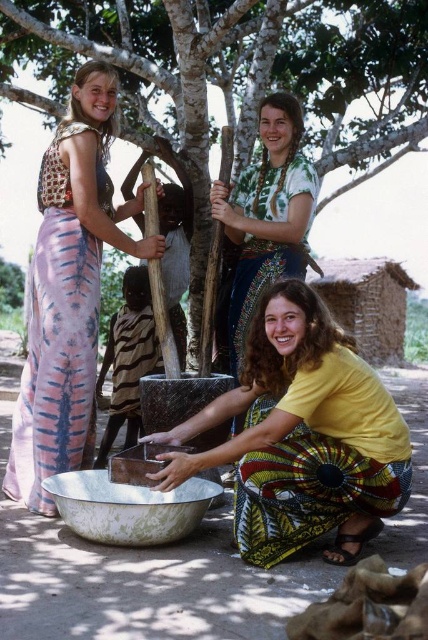
Looking at this image, which is below, pink tie-dye dress at left or striped fabric cloth at center?

striped fabric cloth at center

Can you confirm if pink tie-dye dress at left is taller than striped fabric cloth at center?

Correct, pink tie-dye dress at left is much taller as striped fabric cloth at center.

Locate an element on the screen. Image resolution: width=428 pixels, height=640 pixels. pink tie-dye dress at left is located at coordinates (68, 291).

Identify the location of pink tie-dye dress at left. Image resolution: width=428 pixels, height=640 pixels. (68, 291).

Is pink tie-dye dress at left below greenish metallic bowl at lower center?

No.

Does pink tie-dye dress at left have a larger size compared to greenish metallic bowl at lower center?

Correct, pink tie-dye dress at left is larger in size than greenish metallic bowl at lower center.

Image resolution: width=428 pixels, height=640 pixels. What do you see at coordinates (68, 291) in the screenshot? I see `pink tie-dye dress at left` at bounding box center [68, 291].

The width and height of the screenshot is (428, 640). Find the location of `pink tie-dye dress at left`. pink tie-dye dress at left is located at coordinates (68, 291).

Can you confirm if yellow matte shirt at lower center is wider than green tie-dye shirt at upper center?

Yes, yellow matte shirt at lower center is wider than green tie-dye shirt at upper center.

Is yellow matte shirt at lower center below green tie-dye shirt at upper center?

Indeed, yellow matte shirt at lower center is positioned under green tie-dye shirt at upper center.

This screenshot has height=640, width=428. Find the location of `yellow matte shirt at lower center`. yellow matte shirt at lower center is located at coordinates (302, 436).